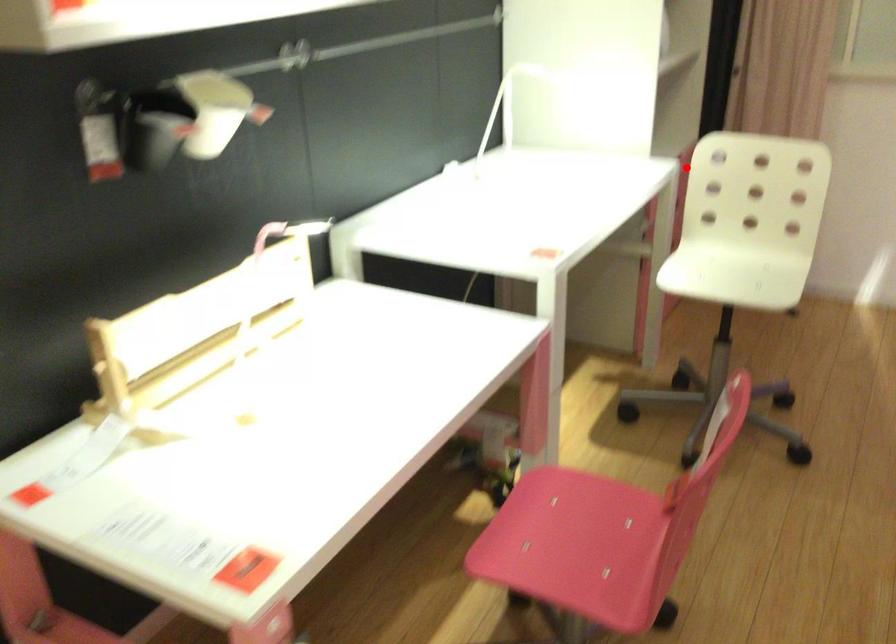
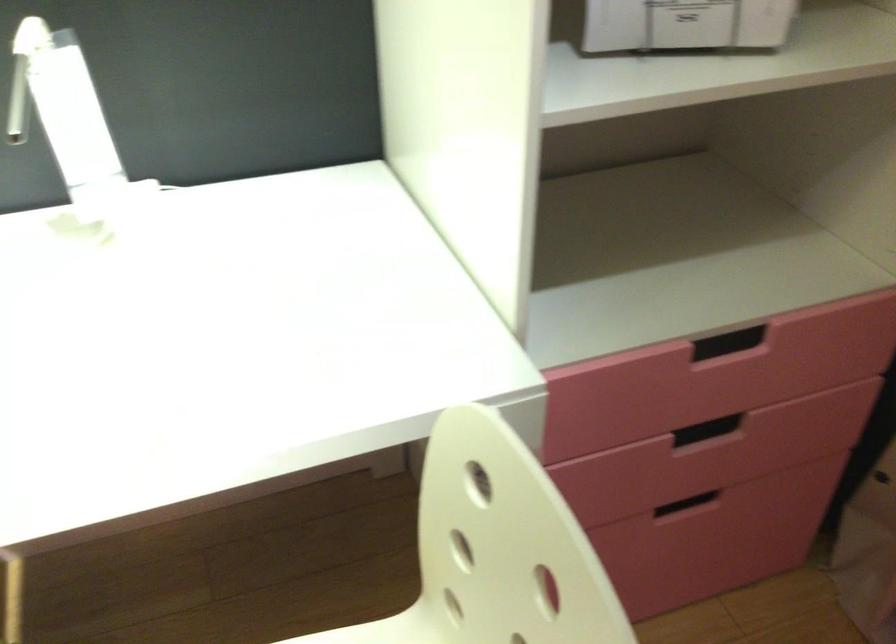
In the second image, find the point that corresponds to the highlighted location in the first image.

(743, 355)